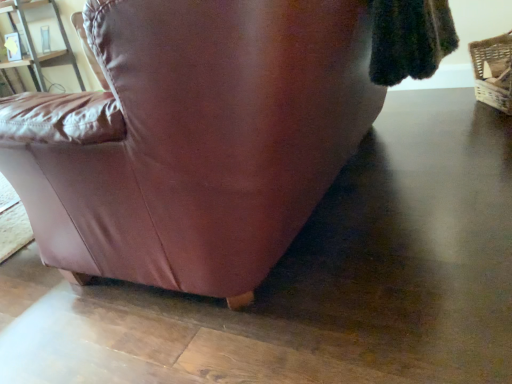
Question: From the image's perspective, would you say matte wood shelf at upper left is positioned over woven straw basket at right?

Choices:
 (A) yes
 (B) no

Answer: (A)

Question: Is matte wood shelf at upper left thinner than woven straw basket at right?

Choices:
 (A) yes
 (B) no

Answer: (B)

Question: Is matte wood shelf at upper left next to woven straw basket at right?

Choices:
 (A) no
 (B) yes

Answer: (A)

Question: Does matte wood shelf at upper left have a larger size compared to woven straw basket at right?

Choices:
 (A) no
 (B) yes

Answer: (B)

Question: Is there a large distance between matte wood shelf at upper left and woven straw basket at right?

Choices:
 (A) no
 (B) yes

Answer: (B)

Question: Considering the relative positions of matte wood shelf at upper left and woven straw basket at right in the image provided, is matte wood shelf at upper left to the left of woven straw basket at right from the viewer's perspective?

Choices:
 (A) yes
 (B) no

Answer: (A)

Question: Is woven straw basket at right turned away from matte wood shelf at upper left?

Choices:
 (A) no
 (B) yes

Answer: (A)

Question: Considering the relative positions of woven straw basket at right and matte wood shelf at upper left in the image provided, is woven straw basket at right in front of matte wood shelf at upper left?

Choices:
 (A) no
 (B) yes

Answer: (B)

Question: Is woven straw basket at right shorter than matte wood shelf at upper left?

Choices:
 (A) no
 (B) yes

Answer: (B)

Question: Would you say matte wood shelf at upper left is part of woven straw basket at right's contents?

Choices:
 (A) no
 (B) yes

Answer: (A)

Question: Is woven straw basket at right located outside matte wood shelf at upper left?

Choices:
 (A) no
 (B) yes

Answer: (B)

Question: From a real-world perspective, is woven straw basket at right located higher than matte wood shelf at upper left?

Choices:
 (A) yes
 (B) no

Answer: (B)

Question: From a real-world perspective, is woven straw basket at right physically located above or below matte wood shelf at upper left?

Choices:
 (A) above
 (B) below

Answer: (B)